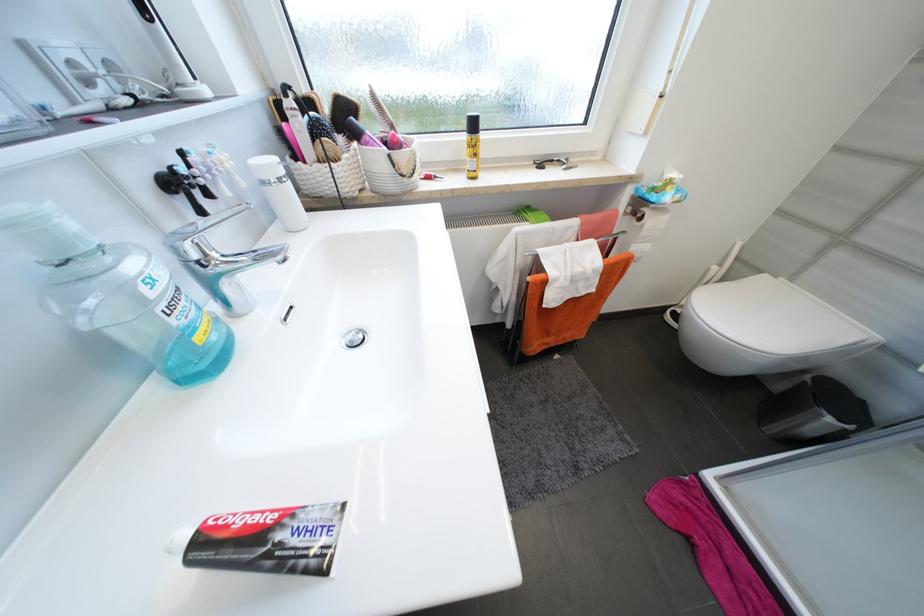
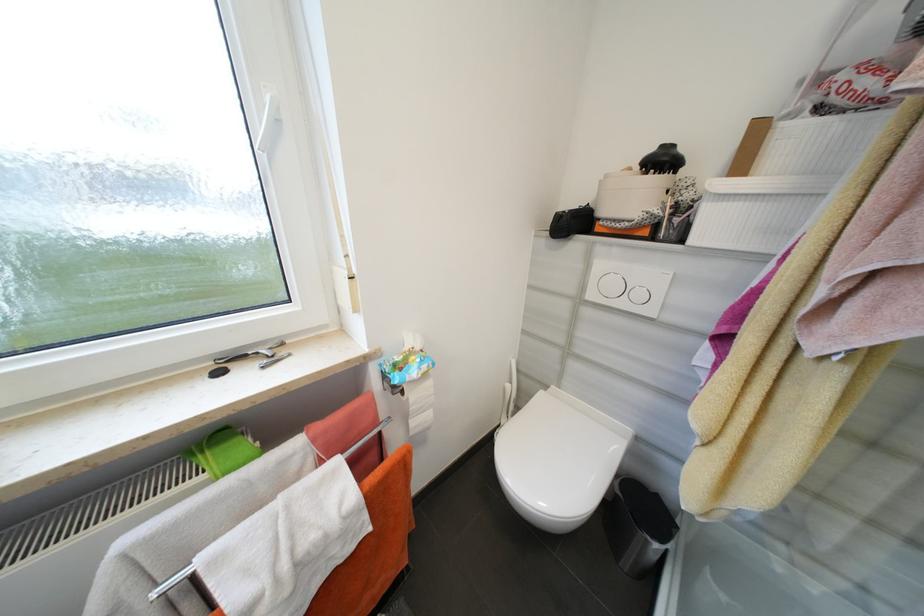
The point at (x=647, y=219) is marked in the first image. Where is the corresponding point in the second image?

(407, 392)